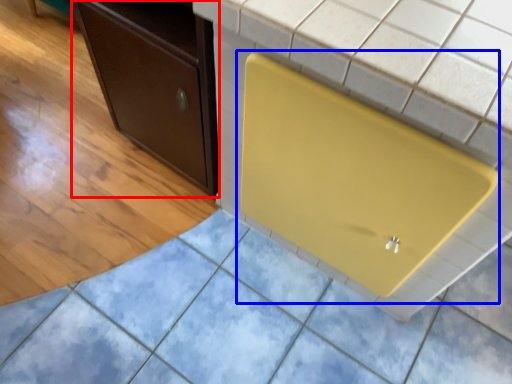
Question: Which point is further to the camera, cabinetry (highlighted by a red box) or appliance (highlighted by a blue box)?

Choices:
 (A) cabinetry
 (B) appliance

Answer: (A)